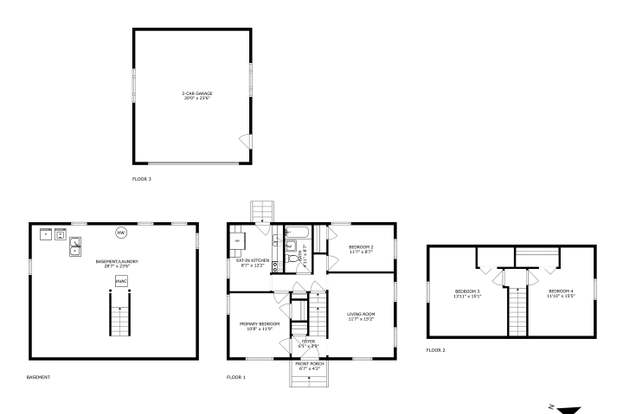
Image resolution: width=623 pixels, height=414 pixels. Identify the location of floor 3. (206, 150).